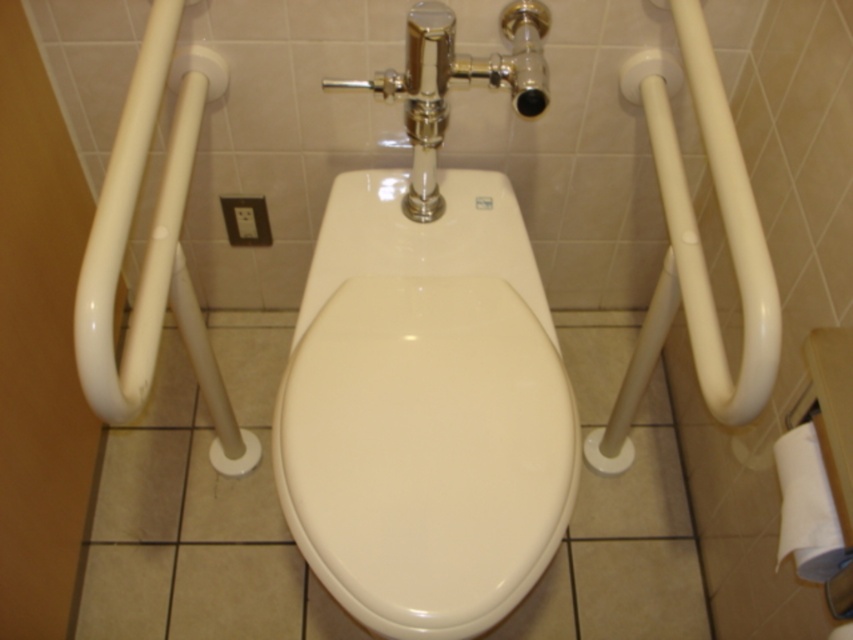
Question: Estimate the real-world distances between objects in this image. Which object is closer to the white glossy toilet at center?

Choices:
 (A) white glossy grab bar at right
 (B) white glossy grab bar at upper left

Answer: (B)

Question: Is white glossy toilet at center thinner than white glossy grab bar at right?

Choices:
 (A) yes
 (B) no

Answer: (B)

Question: In this image, where is white glossy grab bar at upper left located relative to white paper towel at lower right?

Choices:
 (A) above
 (B) below

Answer: (A)

Question: Which point appears closest to the camera in this image?

Choices:
 (A) (154, 0)
 (B) (683, 266)

Answer: (B)

Question: Can you confirm if white glossy toilet at center is positioned to the right of white glossy grab bar at upper left?

Choices:
 (A) yes
 (B) no

Answer: (A)

Question: Among these points, which one is farthest from the camera?

Choices:
 (A) (758, 273)
 (B) (814, 429)
 (C) (143, 333)

Answer: (C)